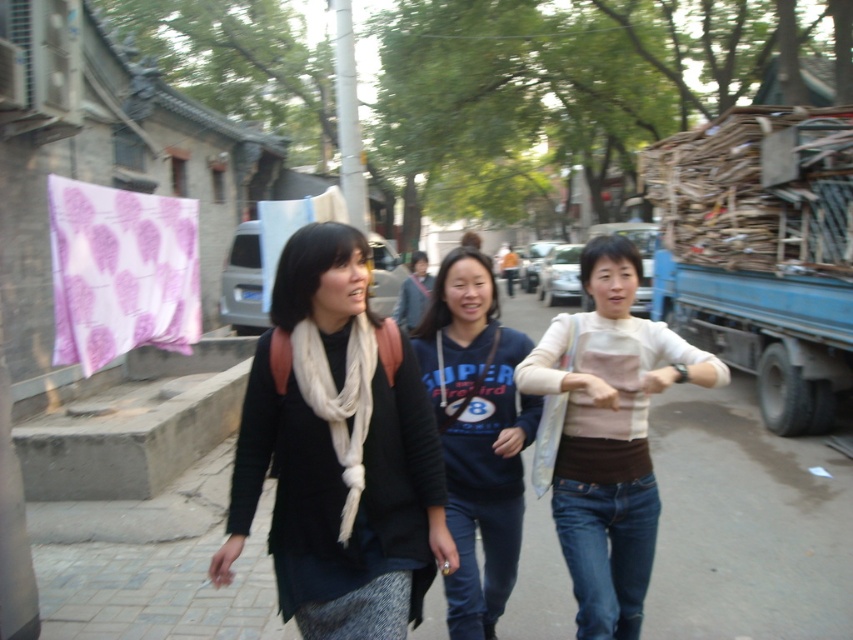
Question: Can you confirm if blue cotton hoodie at center is positioned above white fabric at center?

Choices:
 (A) yes
 (B) no

Answer: (B)

Question: Which object is positioned farthest from the white fabric at center?

Choices:
 (A) purple fabric at left
 (B) white knit sweater at center
 (C) matte black scarf at center
 (D) wooden planks at right

Answer: (C)

Question: Is matte black scarf at center to the right of purple fabric at left from the viewer's perspective?

Choices:
 (A) no
 (B) yes

Answer: (B)

Question: Which object is the farthest from the purple fabric at left?

Choices:
 (A) matte black scarf at center
 (B) white knit sweater at center
 (C) white fabric at center
 (D) wooden planks at right

Answer: (D)

Question: From the image, what is the correct spatial relationship of blue cotton hoodie at center in relation to purple fabric at left?

Choices:
 (A) above
 (B) below

Answer: (B)

Question: Which of the following is the farthest from the observer?

Choices:
 (A) (608, 310)
 (B) (260, 236)
 (C) (500, 452)
 (D) (693, 241)

Answer: (D)